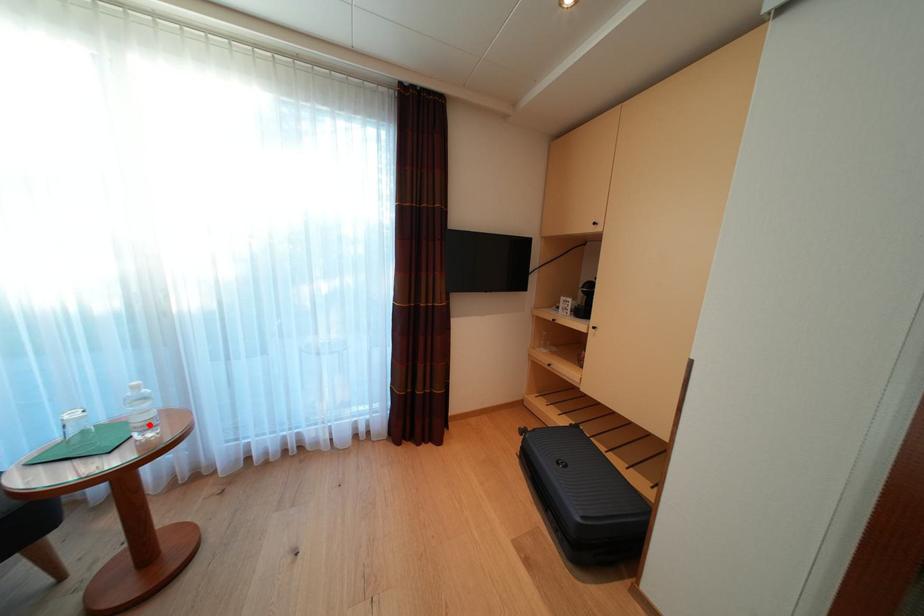
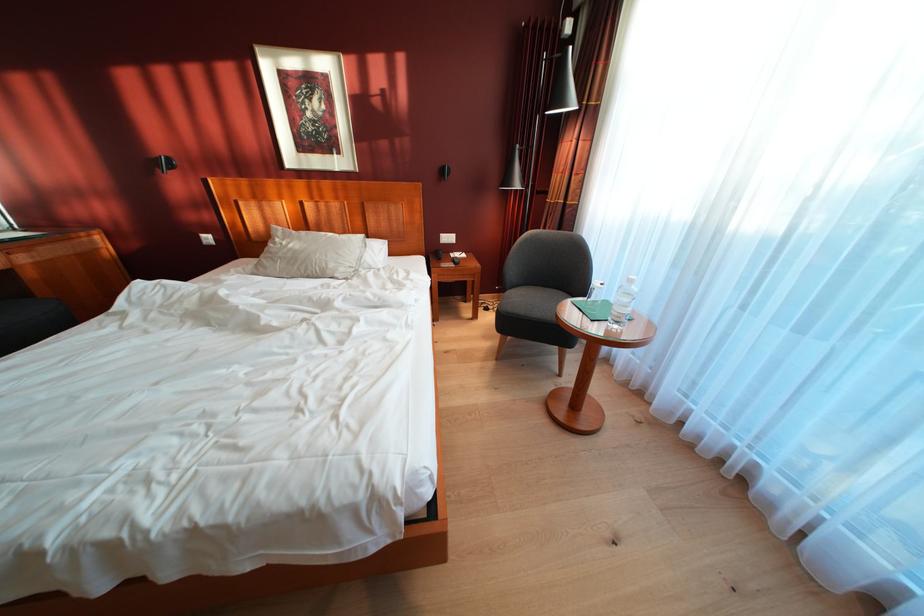
Where in the second image is the point corresponding to the highlighted location from the first image?

(625, 315)